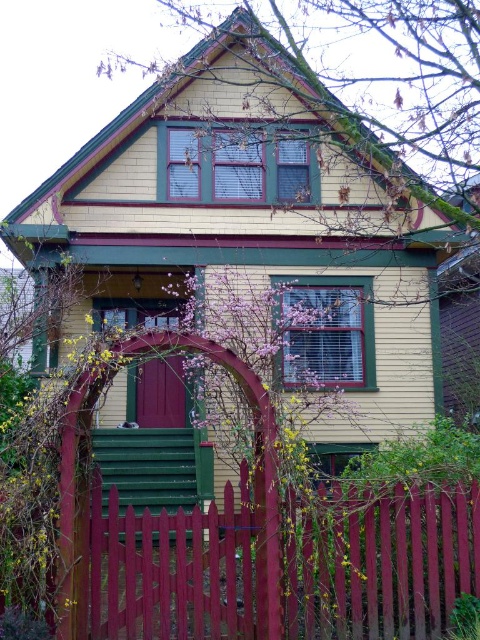
Which is more to the left, smooth wooden fence at center or matte burgundy door at center?

Positioned to the left is matte burgundy door at center.

Based on the photo, does smooth wooden fence at center have a greater height compared to matte burgundy door at center?

Yes, smooth wooden fence at center is taller than matte burgundy door at center.

Locate an element on the screen. The width and height of the screenshot is (480, 640). smooth wooden fence at center is located at coordinates (381, 563).